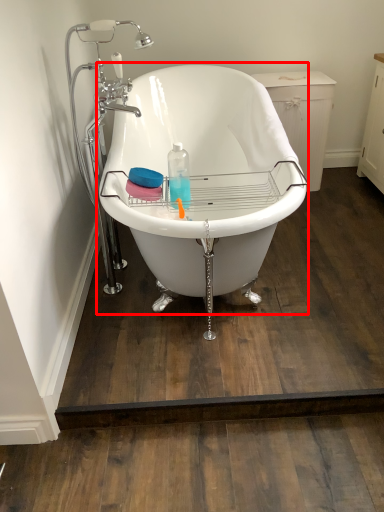
Question: Observing the image, what is the correct spatial positioning of bathtub (annotated by the red box) in reference to faucet?

Choices:
 (A) left
 (B) right

Answer: (B)